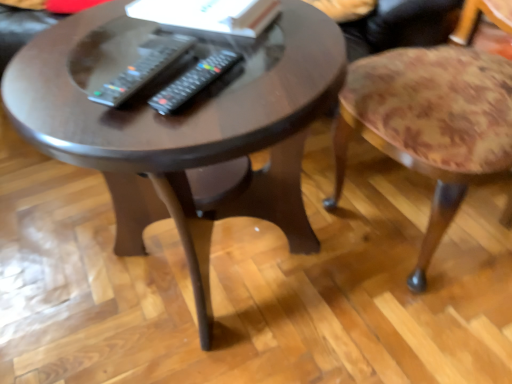
The image size is (512, 384). In order to click on spots to the right of black plastic remote at center, which appears as the 1th remote when viewed from the left in this screenshot , I will do `click(266, 69)`.